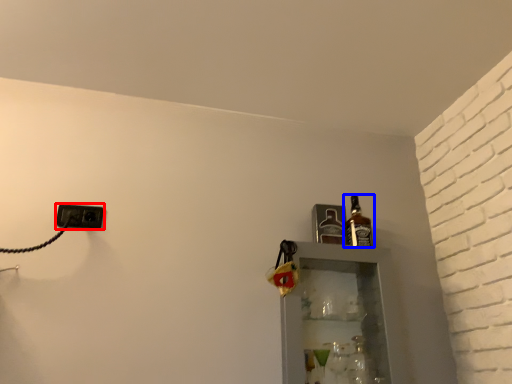
Question: Which point is closer to the camera, electric outlet (highlighted by a red box) or bottle (highlighted by a blue box)?

Choices:
 (A) electric outlet
 (B) bottle

Answer: (A)